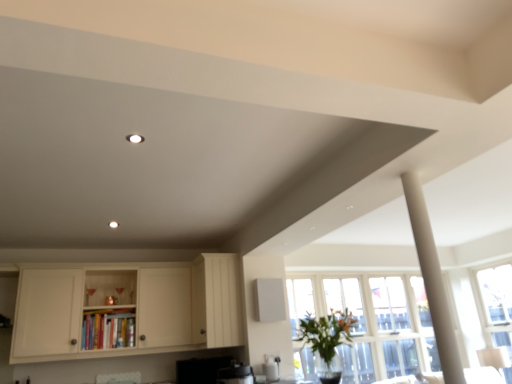
Question: Would you say green leafy plant at lower right is a long distance from white wood cabinet at center, which ranks as the 1th cabinetry in right-to-left order?

Choices:
 (A) no
 (B) yes

Answer: (B)

Question: From the image's perspective, is green leafy plant at lower right under white wood cabinet at center, which appears as the second cabinetry when viewed from the left?

Choices:
 (A) yes
 (B) no

Answer: (A)

Question: Is white wood cabinet at center, which ranks as the 1th cabinetry in right-to-left order, surrounded by green leafy plant at lower right?

Choices:
 (A) no
 (B) yes

Answer: (A)

Question: Is green leafy plant at lower right positioned beyond the bounds of white wood cabinet at center, which ranks as the 1th cabinetry in right-to-left order?

Choices:
 (A) no
 (B) yes

Answer: (B)

Question: Does green leafy plant at lower right touch white wood cabinet at center, which appears as the second cabinetry when viewed from the left?

Choices:
 (A) yes
 (B) no

Answer: (B)

Question: From the image's perspective, is white matte column at right positioned above or below clear glass window at right?

Choices:
 (A) above
 (B) below

Answer: (A)

Question: Is white matte column at right in front of or behind clear glass window at right in the image?

Choices:
 (A) front
 (B) behind

Answer: (A)

Question: Is point (446, 317) positioned closer to the camera than point (479, 281)?

Choices:
 (A) farther
 (B) closer

Answer: (B)

Question: Considering the positions of white matte column at right and clear glass window at right in the image, is white matte column at right wider or thinner than clear glass window at right?

Choices:
 (A) thin
 (B) wide

Answer: (A)

Question: Is white matte cabinet at lower left, marked as the second cabinetry in a right-to-left arrangement, spatially inside green leafy plant at lower right, or outside of it?

Choices:
 (A) outside
 (B) inside

Answer: (A)

Question: Looking at the image, does white matte cabinet at lower left, the 1th cabinetry viewed from the left, seem bigger or smaller compared to green leafy plant at lower right?

Choices:
 (A) big
 (B) small

Answer: (A)

Question: From a real-world perspective, is white matte cabinet at lower left, marked as the second cabinetry in a right-to-left arrangement, physically located above or below green leafy plant at lower right?

Choices:
 (A) above
 (B) below

Answer: (A)

Question: Relative to green leafy plant at lower right, is white matte cabinet at lower left, marked as the second cabinetry in a right-to-left arrangement, in front or behind?

Choices:
 (A) front
 (B) behind

Answer: (B)

Question: From a real-world perspective, is clear glass window at right positioned above or below white wood cabinet at center, which appears as the second cabinetry when viewed from the left?

Choices:
 (A) above
 (B) below

Answer: (B)

Question: Is clear glass window at right bigger or smaller than white wood cabinet at center, which ranks as the 1th cabinetry in right-to-left order?

Choices:
 (A) big
 (B) small

Answer: (B)